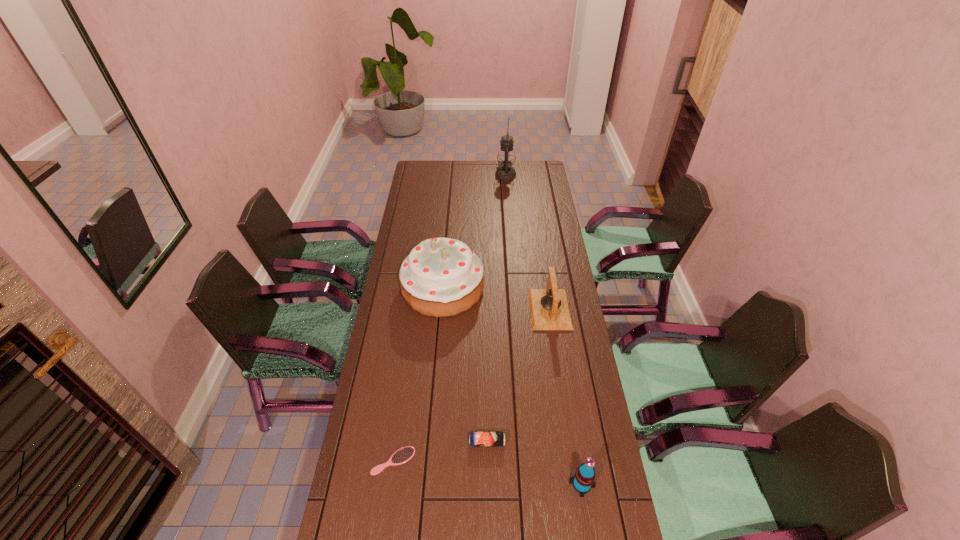
Locate an element on the screen. This screenshot has height=540, width=960. vacant space located 0.360m on the left of the soda is located at coordinates (443, 484).

I want to click on vacant region located 0.160m on the back of the beer can, so click(487, 390).

Identify the location of free point located on the left of the hairbrush. (352, 461).

This screenshot has width=960, height=540. What are the coordinates of `object present at the far edge` in the screenshot? It's located at (506, 157).

The image size is (960, 540). In order to click on cake at the left edge in this screenshot , I will do [x=441, y=277].

At what (x,y) coordinates should I click in order to perform the action: click on hairbrush at the left edge. Please return your answer as a coordinate pair (x, y). Looking at the image, I should click on (404, 454).

Find the location of a particular element. This screenshot has width=960, height=540. bell present at the right edge is located at coordinates (549, 309).

This screenshot has height=540, width=960. What are the coordinates of `soda at the right edge` in the screenshot? It's located at (584, 479).

Locate an element on the screen. This screenshot has height=540, width=960. free spot at the far edge of the desktop is located at coordinates (487, 170).

Where is `free space at the left edge of the desktop`? free space at the left edge of the desktop is located at coordinates (384, 384).